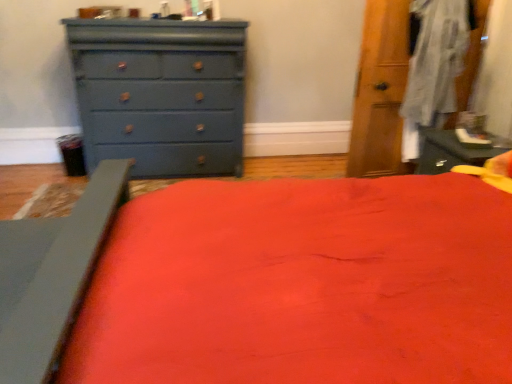
Describe the element at coordinates (51, 275) in the screenshot. I see `matte gray bed frame at lower left` at that location.

Measure the distance between point [45,237] and camera.

Point [45,237] is 5.15 feet away from camera.

Locate an element on the screen. The height and width of the screenshot is (384, 512). matte gray bed frame at lower left is located at coordinates (51, 275).

This screenshot has width=512, height=384. I want to click on matte blue dresser at left, so click(x=161, y=94).

What do you see at coordinates (161, 94) in the screenshot?
I see `matte blue dresser at left` at bounding box center [161, 94].

Where is `matte gray bed frame at lower left`? matte gray bed frame at lower left is located at coordinates (51, 275).

Which is more to the left, matte gray bed frame at lower left or matte blue dresser at left?

From the viewer's perspective, matte gray bed frame at lower left appears more on the left side.

In the scene shown: Between matte gray bed frame at lower left and matte blue dresser at left, which one is positioned behind?

matte blue dresser at left is behind.

Considering the positions of point (25, 251) and point (125, 86), is point (25, 251) closer or farther from the camera than point (125, 86)?

Point (25, 251) is positioned closer to the camera compared to point (125, 86).

From the image's perspective, relative to matte blue dresser at left, is matte gray bed frame at lower left above or below?

Based on their image positions, matte gray bed frame at lower left is located beneath matte blue dresser at left.

In the scene shown: From a real-world perspective, who is located lower, matte gray bed frame at lower left or matte blue dresser at left?

In real-world perspective, matte gray bed frame at lower left is lower.

Looking at their sizes, would you say matte gray bed frame at lower left is wider or thinner than matte blue dresser at left?

Considering their sizes, matte gray bed frame at lower left looks slimmer than matte blue dresser at left.

Which of these two, matte gray bed frame at lower left or matte blue dresser at left, stands shorter?

With less height is matte gray bed frame at lower left.

Considering the sizes of matte gray bed frame at lower left and matte blue dresser at left in the image, is matte gray bed frame at lower left bigger or smaller than matte blue dresser at left?

matte gray bed frame at lower left is smaller than matte blue dresser at left.

Would you say matte blue dresser at left is part of matte gray bed frame at lower left's contents?

No, matte blue dresser at left is not inside matte gray bed frame at lower left.

Looking at this image, is matte gray bed frame at lower left directly adjacent to matte blue dresser at left?

There is a gap between matte gray bed frame at lower left and matte blue dresser at left.

Is matte gray bed frame at lower left positioned with its back to matte blue dresser at left?

No.

What's the angular difference between matte gray bed frame at lower left and matte blue dresser at left's facing directions?

The angle between the facing direction of matte gray bed frame at lower left and the facing direction of matte blue dresser at left is 90.2 degrees.

Locate an element on the screen. This screenshot has height=384, width=512. bed frame lying in front of the matte blue dresser at left is located at coordinates (51, 275).

Does matte blue dresser at left appear on the left side of matte gray bed frame at lower left?

No.

Is matte blue dresser at left positioned in front of matte gray bed frame at lower left?

No, matte blue dresser at left is behind matte gray bed frame at lower left.

Is point (212, 138) positioned before point (4, 246)?

No, (212, 138) is behind (4, 246).

From the image's perspective, which one is positioned lower, matte blue dresser at left or matte gray bed frame at lower left?

matte gray bed frame at lower left.

From a real-world perspective, is matte blue dresser at left physically located above or below matte gray bed frame at lower left?

In terms of real-world spatial position, matte blue dresser at left is above matte gray bed frame at lower left.

In terms of width, does matte blue dresser at left look wider or thinner when compared to matte gray bed frame at lower left?

Clearly, matte blue dresser at left has more width compared to matte gray bed frame at lower left.

Considering the sizes of matte blue dresser at left and matte gray bed frame at lower left in the image, is matte blue dresser at left taller or shorter than matte gray bed frame at lower left?

matte blue dresser at left is taller than matte gray bed frame at lower left.

In the scene shown: Which of these two, matte blue dresser at left or matte gray bed frame at lower left, is smaller?

Smaller between the two is matte gray bed frame at lower left.

Is matte blue dresser at left completely or partially outside of matte gray bed frame at lower left?

Yes, matte blue dresser at left is not within matte gray bed frame at lower left.

Are matte blue dresser at left and matte gray bed frame at lower left far apart?

Yes, matte blue dresser at left is far from matte gray bed frame at lower left.

Is matte blue dresser at left positioned with its back to matte gray bed frame at lower left?

matte blue dresser at left is not turned away from matte gray bed frame at lower left.

What are the coordinates of `bed frame below the matte blue dresser at left (from a real-world perspective)` in the screenshot? It's located at (51, 275).

In order to click on bed frame that is under the matte blue dresser at left (from a real-world perspective) in this screenshot , I will do 51,275.

This screenshot has width=512, height=384. I want to click on bed frame that is in front of the matte blue dresser at left, so coord(51,275).